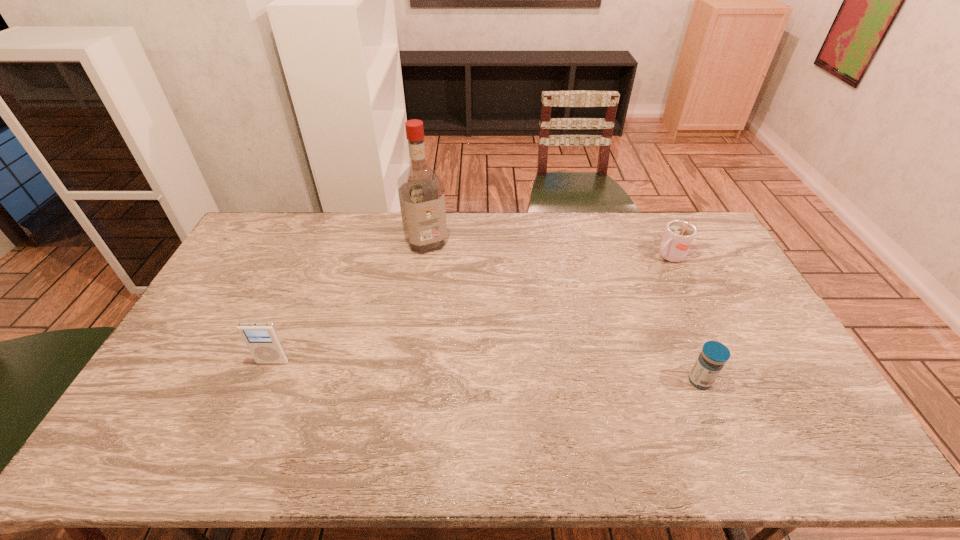
Locate an element on the screen. vacant area located 0.320m on the side with the handle of the cup is located at coordinates (598, 303).

This screenshot has width=960, height=540. I want to click on vacant space situated 0.200m on the side with the handle of the cup, so click(x=622, y=287).

The height and width of the screenshot is (540, 960). Find the location of `blank space located 0.350m on the front-facing side of the liquor`. blank space located 0.350m on the front-facing side of the liquor is located at coordinates (468, 322).

Image resolution: width=960 pixels, height=540 pixels. Find the location of `free location located 0.350m on the front-facing side of the liquor`. free location located 0.350m on the front-facing side of the liquor is located at coordinates (468, 322).

Find the location of a particular element. vacant space located on the front-facing side of the liquor is located at coordinates (462, 309).

At what (x,y) coordinates should I click in order to perform the action: click on cup at the far edge. Please return your answer as a coordinate pair (x, y). The image size is (960, 540). Looking at the image, I should click on (678, 237).

The width and height of the screenshot is (960, 540). I want to click on liquor that is at the far edge, so click(x=421, y=192).

Identify the location of object positioned at the near edge. The height and width of the screenshot is (540, 960). (711, 360).

You are a GUI agent. You are given a task and a screenshot of the screen. Output one action in this format:
    pyautogui.click(x=<x>, y=<y>)
    Task: Click on the object that is at the right edge
    The image size is (960, 540).
    Given the screenshot: What is the action you would take?
    pyautogui.click(x=678, y=237)

Find the location of a particular element. This screenshot has width=960, height=540. object that is at the far right corner is located at coordinates (678, 237).